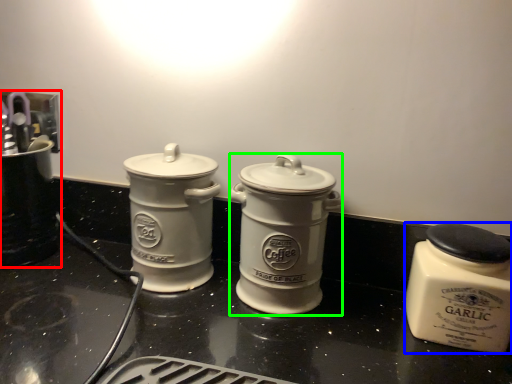
Question: Which object is the closest to the appliance (highlighted by a red box)? Choose among these: kitchen appliance (highlighted by a blue box) or kitchen appliance (highlighted by a green box).

Choices:
 (A) kitchen appliance
 (B) kitchen appliance

Answer: (B)